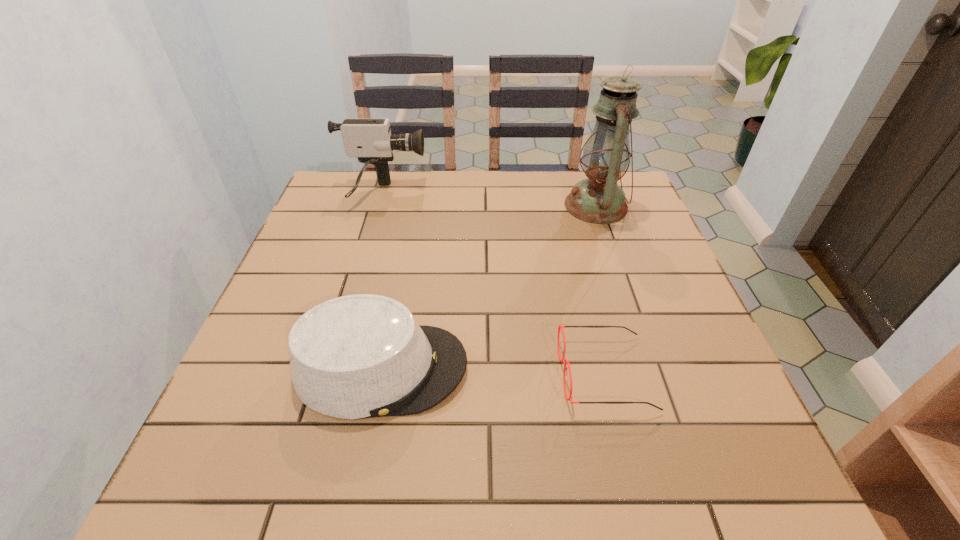
The width and height of the screenshot is (960, 540). In order to click on vacant area that lies between the oil lamp and the camcorder in this screenshot , I will do `click(489, 200)`.

The width and height of the screenshot is (960, 540). I want to click on free space between the hat and the tallest object, so click(x=489, y=287).

The height and width of the screenshot is (540, 960). Find the location of `unoccupied area between the camcorder and the tallest object`. unoccupied area between the camcorder and the tallest object is located at coordinates (489, 200).

Identify the location of free space between the second tallest object and the hat. (381, 281).

Select which object appears as the third closest to the hat. Please provide its 2D coordinates. Your answer should be formatted as a tuple, i.e. [(x, y)], where the tuple contains the x and y coordinates of a point satisfying the conditions above.

[(598, 199)]

Locate an element on the screen. object that stands as the closest to the second shortest object is located at coordinates (562, 360).

Find the location of a particular element. vacant region that satisfies the following two spatial constraints: 1. on the recording direction of the third shortest object; 2. on the right side of the tallest object is located at coordinates (378, 206).

Find the location of `free space in the image that satisfies the following two spatial constraints: 1. on the recording direction of the oil lamp; 2. on the right side of the camcorder`. free space in the image that satisfies the following two spatial constraints: 1. on the recording direction of the oil lamp; 2. on the right side of the camcorder is located at coordinates (378, 206).

The height and width of the screenshot is (540, 960). In order to click on free space that satisfies the following two spatial constraints: 1. on the front side of the oil lamp; 2. on the front-facing side of the second shortest object in this screenshot , I will do 651,368.